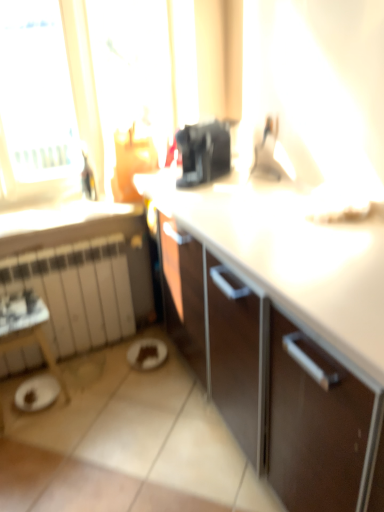
Where is `unoccupied area in front of brown matte plate at lower center`? The height and width of the screenshot is (512, 384). unoccupied area in front of brown matte plate at lower center is located at coordinates (140, 385).